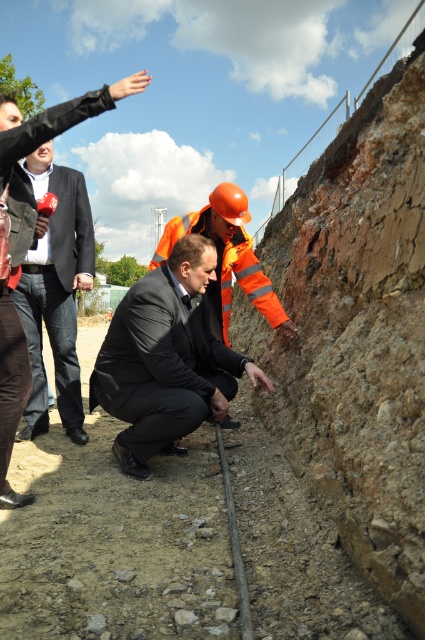
Looking at this image, you are a photographer standing at the back of the group. You want to take a photo that includes both the matte black suit at center and the reflective orange safety vest at center. Which object should you position closer to the camera to ensure both are fully visible in the frame?

Since the matte black suit at center is taller than the reflective orange safety vest at center, positioning the reflective orange safety vest at center closer to the camera will help ensure both are fully visible in the frame.

You are a photographer positioned at the back of the group. You want to take a photo that includes both the matte black suit at left and the reflective orange safety vest at center. Which person should you focus on first to ensure both are in clear focus?

You should focus on the matte black suit at left first because it is closer to you than the reflective orange safety vest at center, so starting with the closer subject will help achieve focus on both.

You are a photographer trying to capture a clear photo of the matte black suit at center and the reflective orange safety vest at center. Since the background is bright, you want to ensure both subjects are well lit. Which object might require additional lighting to avoid appearing too dark in the photo?

The matte black suit at center might require additional lighting because matte black surfaces tend to absorb more light and can appear darker in photos compared to the reflective orange safety vest at center, which may reflect more light and stay well lit.